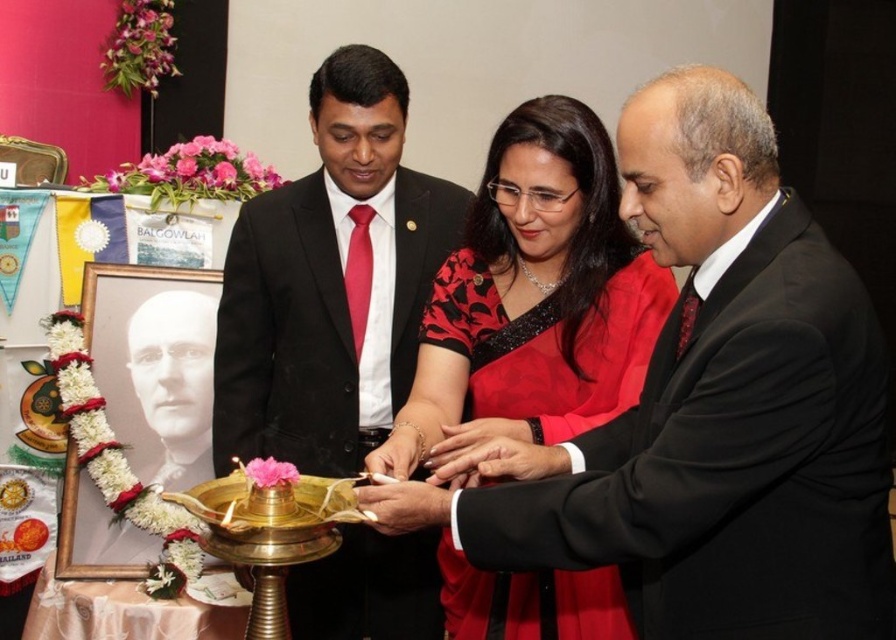
Question: Is matte black suit at center to the left of black satin saree at center from the viewer's perspective?

Choices:
 (A) no
 (B) yes

Answer: (B)

Question: Among these points, which one is nearest to the camera?

Choices:
 (A) (342, 620)
 (B) (748, 451)

Answer: (B)

Question: Estimate the real-world distances between objects in this image. Which object is farther from the black glossy portrait at left?

Choices:
 (A) shiny black dress at center
 (B) black satin saree at center

Answer: (A)

Question: Can you confirm if shiny black dress at center is positioned to the right of black glossy portrait at left?

Choices:
 (A) yes
 (B) no

Answer: (A)

Question: Does black satin saree at center appear on the right side of black glossy portrait at left?

Choices:
 (A) yes
 (B) no

Answer: (A)

Question: Based on their relative distances, which object is farther from the shiny black dress at center?

Choices:
 (A) matte black suit at center
 (B) black glossy portrait at left

Answer: (B)